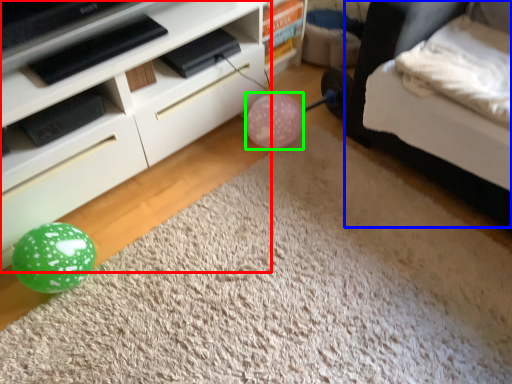
Question: Considering the real-world distances, which object is farthest from furniture (highlighted by a red box)? bed (highlighted by a blue box) or balloon (highlighted by a green box)?

Choices:
 (A) bed
 (B) balloon

Answer: (A)